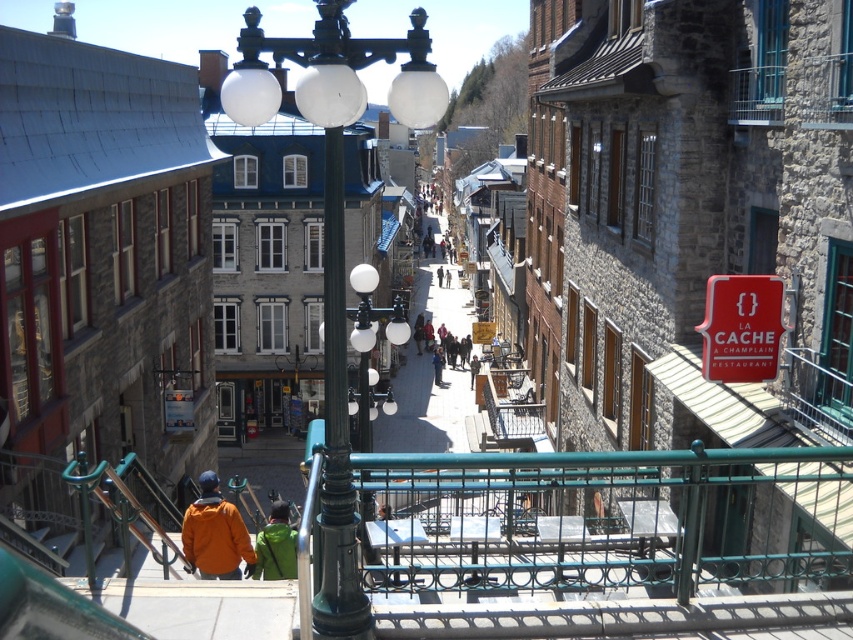
Question: Which of the following is the closest to the observer?

Choices:
 (A) orange fleece jacket at lower left
 (B) green polished metal street light at center
 (C) red matte sign at center right
 (D) green fabric jacket at lower center

Answer: (B)

Question: Among these points, which one is farthest from the camera?

Choices:
 (A) (332, 182)
 (B) (225, 522)
 (C) (282, 538)
 (D) (439, 372)

Answer: (D)

Question: Among these objects, which one is farthest from the camera?

Choices:
 (A) green fabric jacket at lower center
 (B) red matte sign at center right

Answer: (A)

Question: Considering the relative positions of green fabric jacket at lower center and green fabric jacket at center in the image provided, where is green fabric jacket at lower center located with respect to green fabric jacket at center?

Choices:
 (A) below
 (B) above

Answer: (A)

Question: Can you confirm if red matte sign at center right is wider than green fabric jacket at center?

Choices:
 (A) no
 (B) yes

Answer: (B)

Question: Observing the image, what is the correct spatial positioning of black metal pole at center in reference to green fabric jacket at lower center?

Choices:
 (A) right
 (B) left

Answer: (A)